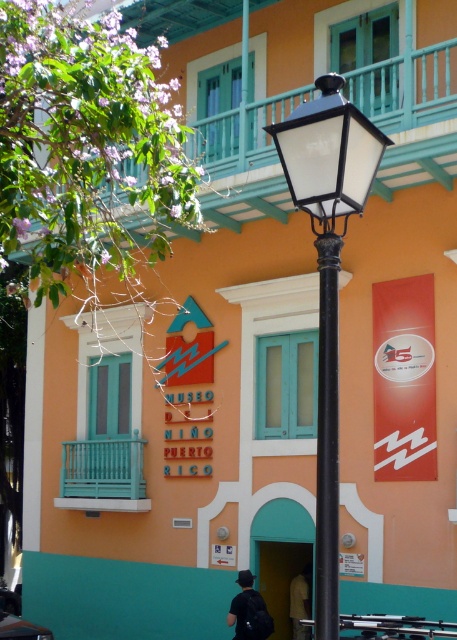
You are standing in front of the Museo del Ni?o Puerto Rico and notice a black matte street light at center and a dark gray fabric shirt at lower center. Which object is positioned higher from the ground?

The black matte street light at center is above the dark gray fabric shirt at lower center, so it is positioned higher from the ground.

In the scene shown: You are standing in front of the Museo del Niyo Puerto Rico and notice two points marked on the building facade. One is at coordinate point (315, 202) and the other at point (244, 625). Which point is closer to your current position?

Point (315, 202) is closer to the camera than point (244, 625), so the point at coordinate point (315, 202) is closer to your current position.

You are standing in front of the Museo del Ni?o Puerto Rico and need to locate the black matte street light at center. According to the coordinates provided, where exactly is it positioned?

The black matte street light at center is located at point coordinates 0.439 on the x axis and 0.718 on the y axis.